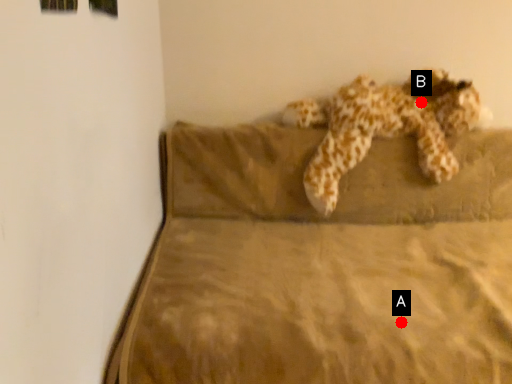
Question: Two points are circled on the image, labeled by A and B beside each circle. Which point is closer to the camera?

Choices:
 (A) A is closer
 (B) B is closer

Answer: (A)